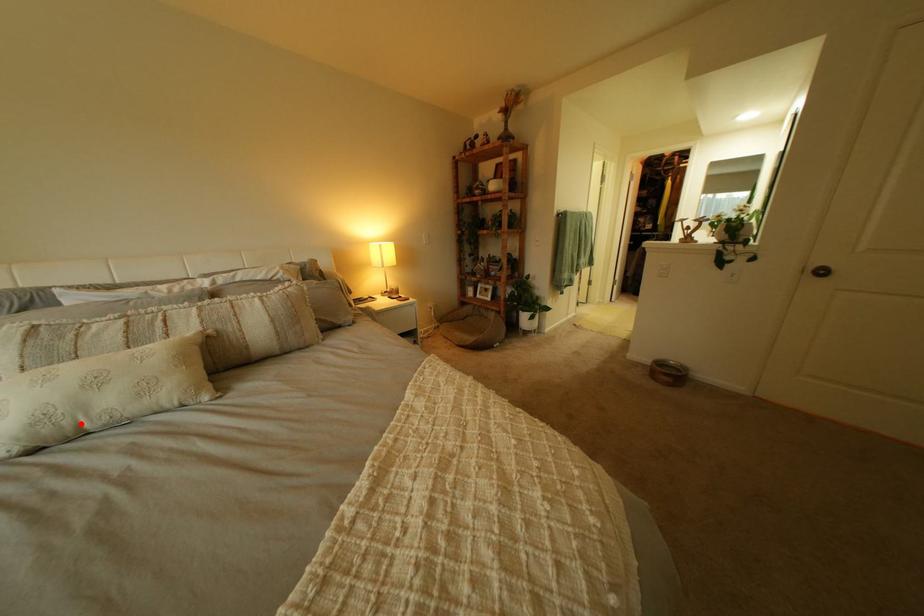
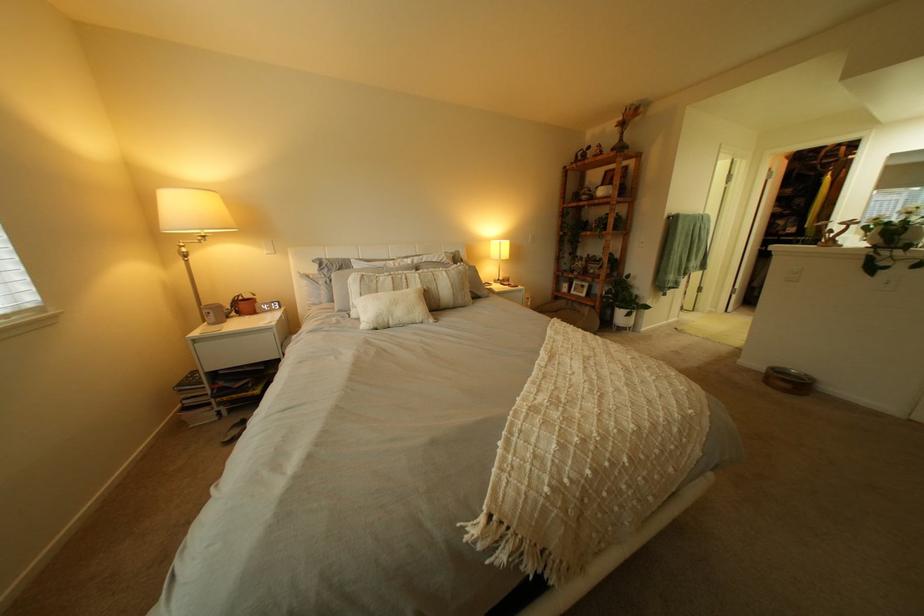
Find the pixel in the second image that matches the highlighted location in the first image.

(400, 320)